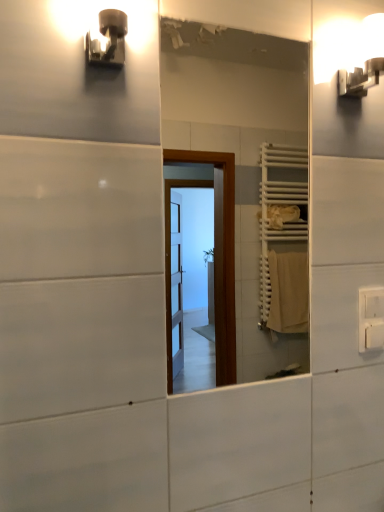
How much space does metallic wall sconce at upper left, the 1th light fixture viewed from the front, occupy vertically?

metallic wall sconce at upper left, the 1th light fixture viewed from the front, is 14.26 centimeters in height.

What are the coordinates of `white plastic electric outlet at upper right` in the screenshot? It's located at (371, 318).

Where is `metallic wall sconce at upper left, which is the 2th light fixture from back to front`? metallic wall sconce at upper left, which is the 2th light fixture from back to front is located at coordinates (108, 39).

Based on the photo, which of these two, white glossy mirror at center or white glossy wall sconce at upper right, arranged as the 1th light fixture when viewed from the back, is thinner?

With smaller width is white glossy mirror at center.

Does white glossy mirror at center lie behind white glossy wall sconce at upper right, arranged as the 1th light fixture when viewed from the back?

No, the depth of white glossy mirror at center is less than that of white glossy wall sconce at upper right, arranged as the 1th light fixture when viewed from the back.

Which object is positioned more to the right, white glossy mirror at center or white glossy wall sconce at upper right, arranged as the 1th light fixture when viewed from the back?

white glossy wall sconce at upper right, arranged as the 1th light fixture when viewed from the back, is more to the right.

Are white glossy mirror at center and white glossy wall sconce at upper right, the second light fixture viewed from the left, far apart?

white glossy mirror at center is far away from white glossy wall sconce at upper right, the second light fixture viewed from the left.

From the image's perspective, which is below, white glossy mirror at center or white plastic electric outlet at upper right?

From the image's view, white plastic electric outlet at upper right is below.

From a real-world perspective, between white glossy mirror at center and white plastic electric outlet at upper right, who is vertically higher?

In real-world perspective, white glossy mirror at center is above.

In terms of height, does white glossy mirror at center look taller or shorter compared to white plastic electric outlet at upper right?

In the image, white glossy mirror at center appears to be taller than white plastic electric outlet at upper right.

Considering the positions of objects metallic wall sconce at upper left, which is the 2th light fixture from back to front, and white glossy mirror at center in the image provided, who is in front, metallic wall sconce at upper left, which is the 2th light fixture from back to front, or white glossy mirror at center?

Positioned in front is metallic wall sconce at upper left, which is the 2th light fixture from back to front.

What's the angular difference between metallic wall sconce at upper left, the 1th light fixture viewed from the front, and white glossy mirror at center's facing directions?

The facing directions of metallic wall sconce at upper left, the 1th light fixture viewed from the front, and white glossy mirror at center are 0.293 degrees apart.

How distant is metallic wall sconce at upper left, which is the 2th light fixture from back to front, from white glossy mirror at center?

metallic wall sconce at upper left, which is the 2th light fixture from back to front, is 6.90 feet from white glossy mirror at center.

Considering the sizes of metallic wall sconce at upper left, the 1th light fixture viewed from the front, and white glossy mirror at center in the image, is metallic wall sconce at upper left, the 1th light fixture viewed from the front, taller or shorter than white glossy mirror at center?

Considering their sizes, metallic wall sconce at upper left, the 1th light fixture viewed from the front, has less height than white glossy mirror at center.

Between metallic wall sconce at upper left, the second light fixture positioned from the right, and white plastic electric outlet at upper right, which one has smaller size?

Smaller between the two is white plastic electric outlet at upper right.

Looking at this image, could you tell me if metallic wall sconce at upper left, which is the 2th light fixture from back to front, is facing white plastic electric outlet at upper right?

No, metallic wall sconce at upper left, which is the 2th light fixture from back to front, is not aimed at white plastic electric outlet at upper right.

Based on the photo, from the image's perspective, between metallic wall sconce at upper left, the 1th light fixture viewed from the front, and white plastic electric outlet at upper right, who is located below?

From the image's view, white plastic electric outlet at upper right is below.

I want to click on electric outlet behind the metallic wall sconce at upper left, which appears as the first light fixture when viewed from the left, so click(x=371, y=318).

Are white plastic electric outlet at upper right and white glossy mirror at center far apart?

Yes, white plastic electric outlet at upper right and white glossy mirror at center are quite far apart.

Considering the relative sizes of white plastic electric outlet at upper right and white glossy mirror at center in the image provided, is white plastic electric outlet at upper right thinner than white glossy mirror at center?

No, white plastic electric outlet at upper right is not thinner than white glossy mirror at center.

Considering the sizes of white plastic electric outlet at upper right and white glossy mirror at center in the image, is white plastic electric outlet at upper right taller or shorter than white glossy mirror at center?

Considering their sizes, white plastic electric outlet at upper right has less height than white glossy mirror at center.

Is white plastic electric outlet at upper right to the left or to the right of white glossy mirror at center in the image?

Based on their positions, white plastic electric outlet at upper right is located to the right of white glossy mirror at center.

Is point (348, 92) more distant than point (109, 55)?

Yes, it is behind point (109, 55).

Considering the relative positions of white glossy wall sconce at upper right, acting as the second light fixture starting from the front, and metallic wall sconce at upper left, the second light fixture positioned from the right, in the image provided, is white glossy wall sconce at upper right, acting as the second light fixture starting from the front, to the right of metallic wall sconce at upper left, the second light fixture positioned from the right, from the viewer's perspective?

Yes.

From the image's perspective, does white glossy wall sconce at upper right, arranged as the 1th light fixture when viewed from the back, appear higher than metallic wall sconce at upper left, which is the 2th light fixture from back to front?

Correct, white glossy wall sconce at upper right, arranged as the 1th light fixture when viewed from the back, appears higher than metallic wall sconce at upper left, which is the 2th light fixture from back to front, in the image.

Which is more to the right, metallic wall sconce at upper left, which is the 2th light fixture from back to front, or white glossy wall sconce at upper right, arranged as the 1th light fixture when viewed from the back?

From the viewer's perspective, white glossy wall sconce at upper right, arranged as the 1th light fixture when viewed from the back, appears more on the right side.

Is white glossy wall sconce at upper right, arranged as the 1th light fixture when viewed from the back, at the back of metallic wall sconce at upper left, the second light fixture positioned from the right?

No, white glossy wall sconce at upper right, arranged as the 1th light fixture when viewed from the back, is not at the back of metallic wall sconce at upper left, the second light fixture positioned from the right.

Measure the distance from metallic wall sconce at upper left, the second light fixture positioned from the right, to white glossy wall sconce at upper right, arranged as the 1th light fixture when viewed from the back.

metallic wall sconce at upper left, the second light fixture positioned from the right, is 21.97 inches from white glossy wall sconce at upper right, arranged as the 1th light fixture when viewed from the back.

Find the location of a particular element. This screenshot has width=384, height=512. mirror on the left of white glossy wall sconce at upper right, acting as the second light fixture starting from the front is located at coordinates (239, 148).

Find the location of a particular element. Image resolution: width=384 pixels, height=512 pixels. electric outlet on the right of white glossy mirror at center is located at coordinates (x=371, y=318).

Which object lies nearer to the anchor point metallic wall sconce at upper left, which appears as the first light fixture when viewed from the left, white glossy wall sconce at upper right, acting as the second light fixture starting from the front, or white glossy mirror at center?

white glossy wall sconce at upper right, acting as the second light fixture starting from the front.

Estimate the real-world distances between objects in this image. Which object is further from metallic wall sconce at upper left, which is the 2th light fixture from back to front, white plastic electric outlet at upper right or white glossy wall sconce at upper right, the second light fixture viewed from the left?

white plastic electric outlet at upper right is further to metallic wall sconce at upper left, which is the 2th light fixture from back to front.

Looking at the image, which one is located further to white plastic electric outlet at upper right, white glossy mirror at center or white glossy wall sconce at upper right, acting as the second light fixture starting from the front?

white glossy mirror at center is further to white plastic electric outlet at upper right.

Based on their spatial positions, is metallic wall sconce at upper left, the 1th light fixture viewed from the front, or white glossy mirror at center closer to white plastic electric outlet at upper right?

metallic wall sconce at upper left, the 1th light fixture viewed from the front, is positioned closer to the anchor white plastic electric outlet at upper right.

Based on their spatial positions, is metallic wall sconce at upper left, which is the 2th light fixture from back to front, or white glossy mirror at center closer to white glossy wall sconce at upper right, acting as the 1th light fixture starting from the right?

metallic wall sconce at upper left, which is the 2th light fixture from back to front, is positioned closer to the anchor white glossy wall sconce at upper right, acting as the 1th light fixture starting from the right.

Estimate the real-world distances between objects in this image. Which object is further from white glossy mirror at center, metallic wall sconce at upper left, which appears as the first light fixture when viewed from the left, or white glossy wall sconce at upper right, arranged as the 1th light fixture when viewed from the back?

metallic wall sconce at upper left, which appears as the first light fixture when viewed from the left.

Based on their spatial positions, is white glossy mirror at center or white plastic electric outlet at upper right further from white glossy wall sconce at upper right, acting as the 1th light fixture starting from the right?

white glossy mirror at center is positioned further to the anchor white glossy wall sconce at upper right, acting as the 1th light fixture starting from the right.

Estimate the real-world distances between objects in this image. Which object is further from metallic wall sconce at upper left, the second light fixture positioned from the right, white glossy wall sconce at upper right, acting as the second light fixture starting from the front, or white plastic electric outlet at upper right?

Based on the image, white plastic electric outlet at upper right appears to be further to metallic wall sconce at upper left, the second light fixture positioned from the right.

Where is `mirror situated between metallic wall sconce at upper left, which appears as the first light fixture when viewed from the left, and white glossy wall sconce at upper right, acting as the second light fixture starting from the front, from left to right`? mirror situated between metallic wall sconce at upper left, which appears as the first light fixture when viewed from the left, and white glossy wall sconce at upper right, acting as the second light fixture starting from the front, from left to right is located at coordinates (239, 148).

Locate an element on the screen. light fixture that lies between white glossy wall sconce at upper right, arranged as the 1th light fixture when viewed from the back, and white plastic electric outlet at upper right from top to bottom is located at coordinates (108, 39).

At what (x,y) coordinates should I click in order to perform the action: click on mirror between metallic wall sconce at upper left, which is the 2th light fixture from back to front, and white plastic electric outlet at upper right. Please return your answer as a coordinate pair (x, y). This screenshot has width=384, height=512. Looking at the image, I should click on (239, 148).

The image size is (384, 512). In order to click on mirror between white glossy wall sconce at upper right, arranged as the 1th light fixture when viewed from the back, and white plastic electric outlet at upper right vertically in this screenshot , I will do `click(239, 148)`.